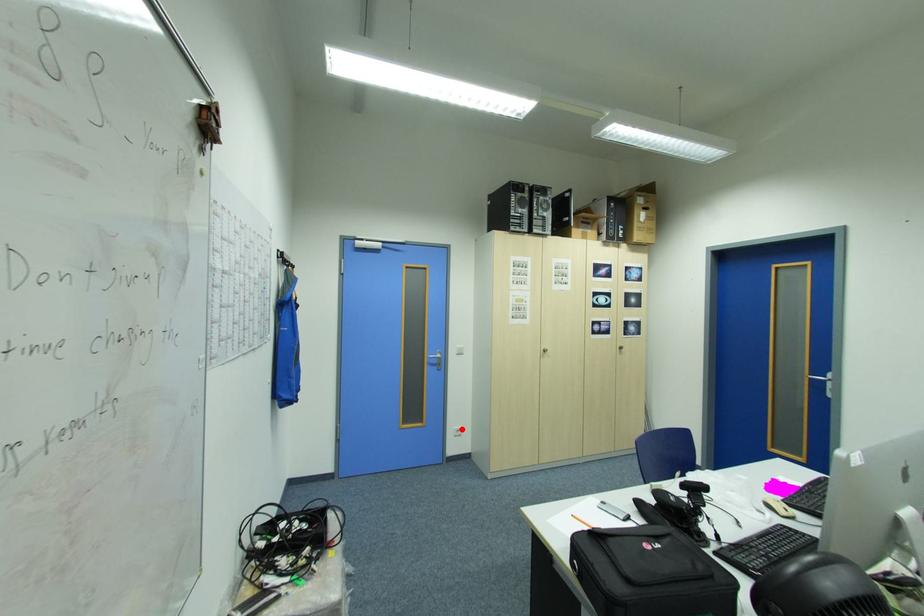
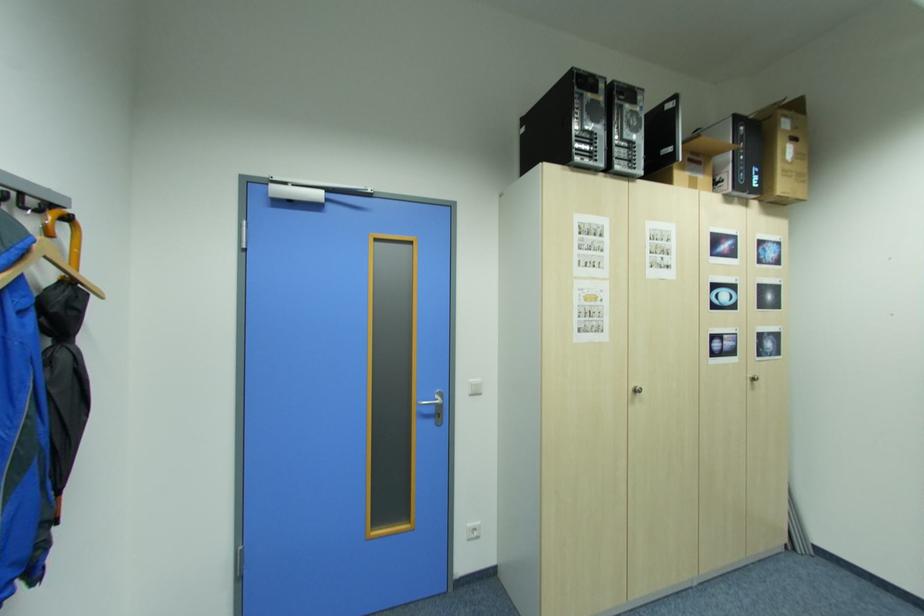
Where in the second image is the point corresponding to the highlighted location from the first image?

(476, 529)